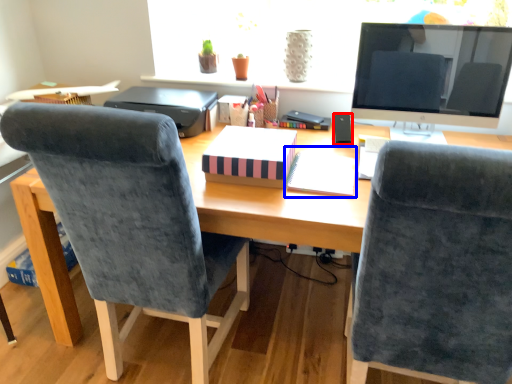
Question: Which point is closer to the camera, speaker (highlighted by a red box) or notebook (highlighted by a blue box)?

Choices:
 (A) speaker
 (B) notebook

Answer: (B)